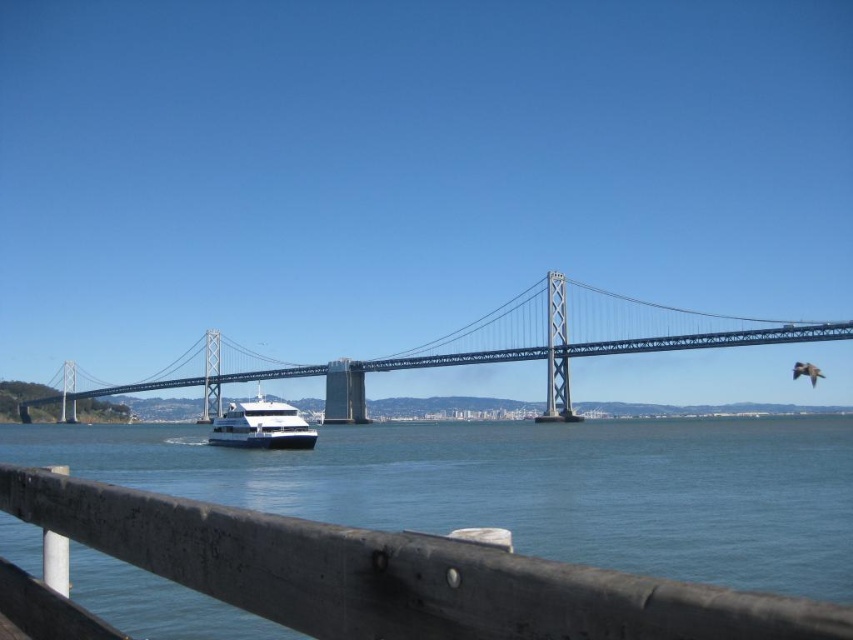
Does metallic gray bridge at center appear on the left side of white glossy cruise ship at center?

Incorrect, metallic gray bridge at center is not on the left side of white glossy cruise ship at center.

Between point (515, 298) and point (260, 406), which one is positioned in front?

Positioned in front is point (260, 406).

Locate an element on the screen. The height and width of the screenshot is (640, 853). metallic gray bridge at center is located at coordinates (592, 332).

Does wooden rail at lower center lie behind white glossy cruise ship at center?

Answer: No.

Is point (503, 602) more distant than point (252, 422)?

No, it is not.

Is point (16, 513) in front of point (250, 433)?

Yes, point (16, 513) is closer to viewer.

The width and height of the screenshot is (853, 640). Find the location of `wooden rail at lower center`. wooden rail at lower center is located at coordinates (393, 573).

Can you confirm if wooden rail at lower center is smaller than metallic gray bridge at center?

Yes.

Is wooden rail at lower center closer to the viewer compared to metallic gray bridge at center?

Yes, wooden rail at lower center is in front of metallic gray bridge at center.

Locate an element on the screen. wooden rail at lower center is located at coordinates (393, 573).

I want to click on wooden rail at lower center, so click(393, 573).